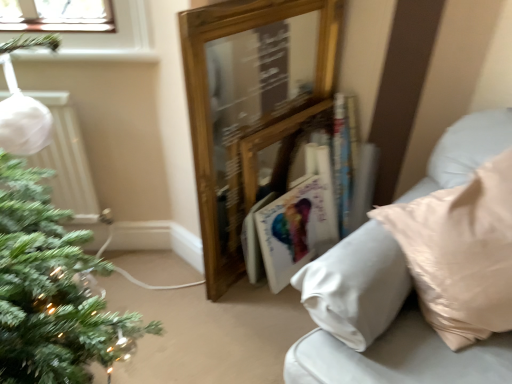
Question: Choose the correct answer: Is white matte radiator at left inside white glossy magazine at center or outside it?

Choices:
 (A) inside
 (B) outside

Answer: (B)

Question: Relative to white glossy magazine at center, is white matte radiator at left in front or behind?

Choices:
 (A) behind
 (B) front

Answer: (B)

Question: Estimate the real-world distances between objects in this image. Which object is farther from the white glossy magazine at center?

Choices:
 (A) white matte radiator at left
 (B) white satin pillow at right
 (C) hardcover book at center

Answer: (A)

Question: Considering the real-world distances, which object is closest to the hardcover book at center?

Choices:
 (A) white glossy magazine at center
 (B) white matte radiator at left
 (C) white satin pillow at right

Answer: (A)